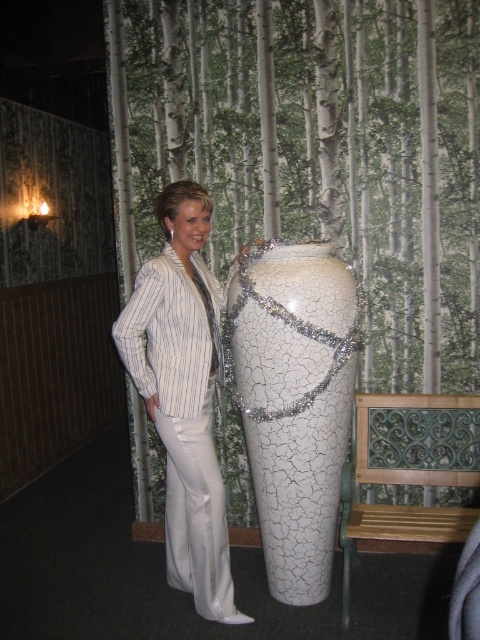
Question: Which of the following is the farthest from the observer?

Choices:
 (A) cracked white vase at center
 (B) white satin suit at center

Answer: (B)

Question: Is cracked white vase at center closer to the viewer compared to white satin suit at center?

Choices:
 (A) no
 (B) yes

Answer: (B)

Question: Which object is closer to the camera taking this photo?

Choices:
 (A) cracked white vase at center
 (B) white satin suit at center

Answer: (A)

Question: Is cracked white vase at center positioned at the back of white satin suit at center?

Choices:
 (A) no
 (B) yes

Answer: (A)

Question: Can you confirm if cracked white vase at center is smaller than white satin suit at center?

Choices:
 (A) no
 (B) yes

Answer: (B)

Question: Which point is closer to the camera taking this photo?

Choices:
 (A) (245, 433)
 (B) (205, 365)

Answer: (B)